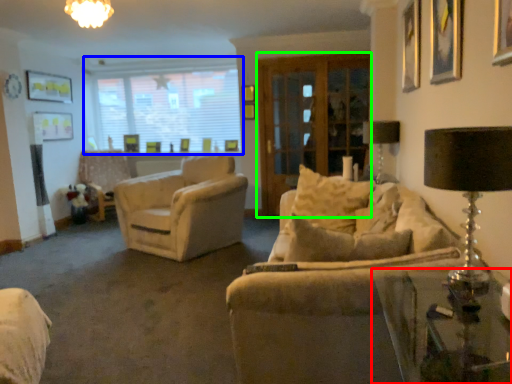
Question: Considering the real-world distances, which object is closest to table (highlighted by a red box)? window (highlighted by a blue box) or screen door (highlighted by a green box).

Choices:
 (A) window
 (B) screen door

Answer: (B)